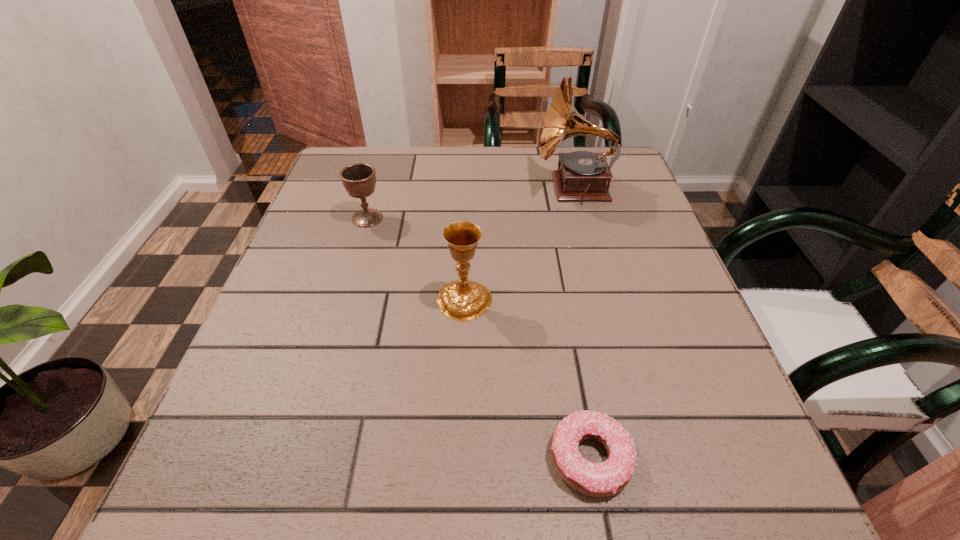
At what (x,y) coordinates should I click in order to perform the action: click on vacant region at the left edge. Please return your answer as a coordinate pair (x, y). This screenshot has width=960, height=540. Looking at the image, I should click on (295, 316).

Identify the location of vacant space at the right edge. (679, 393).

The height and width of the screenshot is (540, 960). I want to click on vacant position at the far left corner of the desktop, so click(x=396, y=147).

The width and height of the screenshot is (960, 540). I want to click on vacant area at the far right corner of the desktop, so click(x=614, y=170).

Where is `free space between the tallest object and the left chalice`? free space between the tallest object and the left chalice is located at coordinates (471, 202).

The width and height of the screenshot is (960, 540). I want to click on vacant region between the left chalice and the third shortest object, so click(x=416, y=259).

Find the location of a particular element. This screenshot has width=960, height=540. free space between the tallest object and the second nearest object is located at coordinates (519, 244).

Identify the location of vacant point located between the doughnut and the right chalice. (527, 379).

At what (x,y) coordinates should I click in order to perform the action: click on free spot between the right chalice and the tallest object. Please return your answer as a coordinate pair (x, y). Looking at the image, I should click on (519, 244).

At what (x,y) coordinates should I click in order to perform the action: click on free space between the doughnut and the nearer chalice. Please return your answer as a coordinate pair (x, y). The height and width of the screenshot is (540, 960). Looking at the image, I should click on (527, 379).